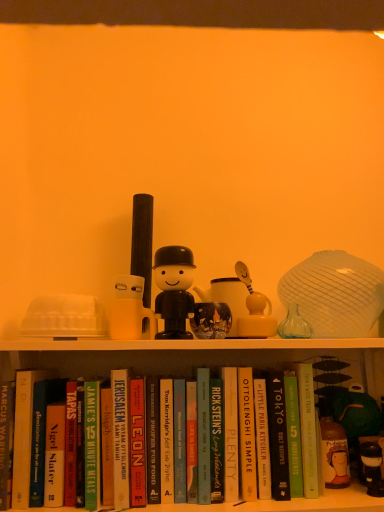
Question: Is black matte figure at center, the 2th toy when ordered from right to left, wider or thinner than hardcover book at center, arranged as the 4th paperback book when viewed from the left?

Choices:
 (A) wide
 (B) thin

Answer: (B)

Question: In terms of height, does black matte figure at center, marked as the first toy in a left-to-right arrangement, look taller or shorter compared to hardcover book at center, which appears as the 8th paperback book when viewed from the right?

Choices:
 (A) tall
 (B) short

Answer: (B)

Question: Based on their relative distances, which object is farther from the green matte book at center, positioned as the eleventh paperback book in left-to-right order?

Choices:
 (A) white matte shelf at upper center
 (B) matte white candle holder at center
 (C) hardcover book at center, the 3th paperback book from the left
 (D) hardcover book at center, which appears as the 10th paperback book when viewed from the right
 (E) hardcover book at center, marked as the ninth paperback book in a left-to-right arrangement

Answer: (D)

Question: Which of these objects is positioned farthest from the hardcover book at center, which is the 8th paperback book from left to right?

Choices:
 (A) hardcover book at center, marked as the ninth paperback book in a left-to-right arrangement
 (B) hardcover book at center, the 6th paperback book from the left
 (C) hardcover book at center, the second paperback book from the left
 (D) white matte shelf at upper center
 (E) black matte figure at center, marked as the first toy in a left-to-right arrangement

Answer: (C)